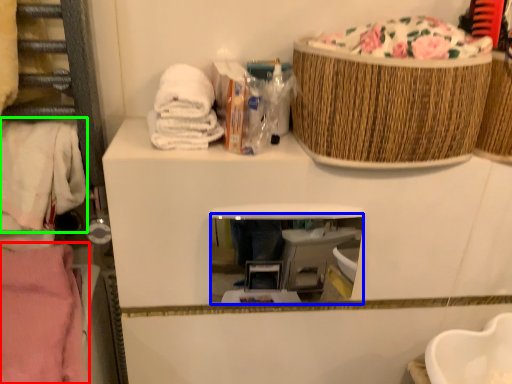
Question: Which object is positioned closest to clothing (highlighted by a red box)? Select from mirror (highlighted by a blue box) and clothing (highlighted by a green box).

Choices:
 (A) mirror
 (B) clothing

Answer: (B)